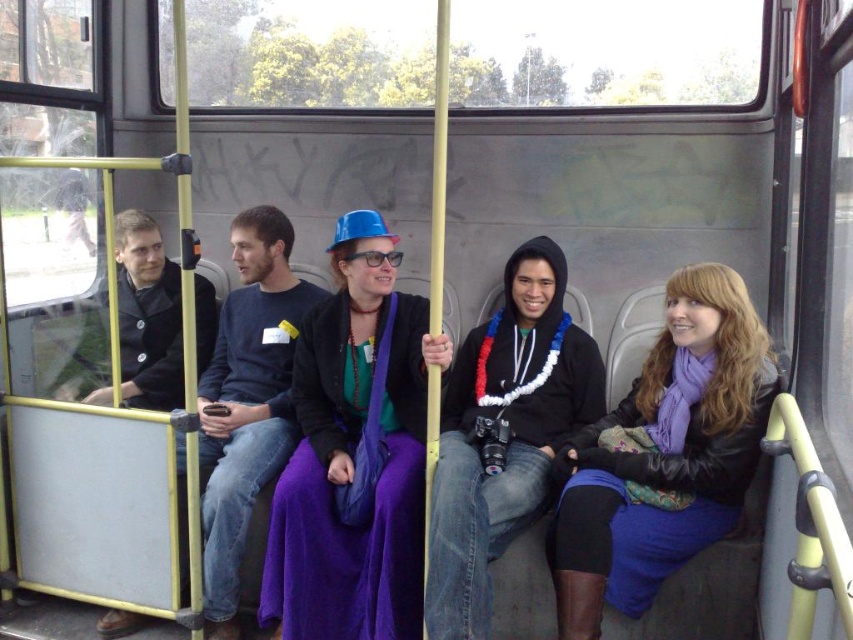
How distant is matte black hoodie at center from purple fabric coach at center?

A distance of 30.51 inches exists between matte black hoodie at center and purple fabric coach at center.

Can you confirm if matte black hoodie at center is shorter than purple fabric coach at center?

Correct, matte black hoodie at center is not as tall as purple fabric coach at center.

Which is behind, point (480, 524) or point (216, 616)?

The point (216, 616) is behind.

Find the location of a particular element. This screenshot has height=640, width=853. matte black hoodie at center is located at coordinates (506, 433).

Can you confirm if purple matte scarf at center is taller than matte black hoodie at center?

Incorrect, purple matte scarf at center's height is not larger of matte black hoodie at center's.

Who is higher up, purple matte scarf at center or matte black hoodie at center?

Positioned higher is matte black hoodie at center.

The width and height of the screenshot is (853, 640). I want to click on purple matte scarf at center, so click(664, 454).

Between purple matte scarf at center and matte black coat at left, which one is positioned lower?

purple matte scarf at center

Describe the element at coordinates (664, 454) in the screenshot. Image resolution: width=853 pixels, height=640 pixels. I see `purple matte scarf at center` at that location.

Where is `purple matte scarf at center`? Image resolution: width=853 pixels, height=640 pixels. purple matte scarf at center is located at coordinates (664, 454).